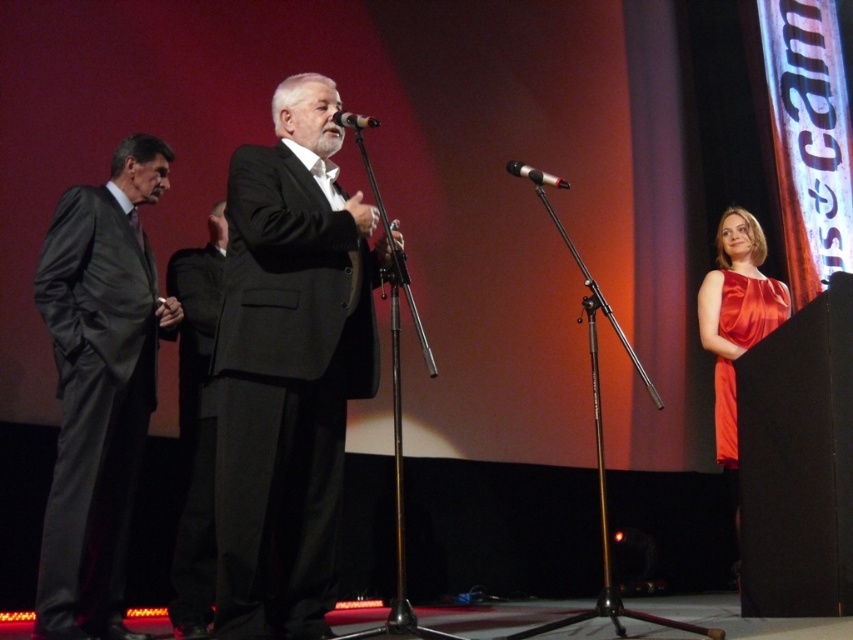
Question: Which object is the farthest from the matte gray suit at left?

Choices:
 (A) metallic silver microphone at center
 (B) satin dress at right
 (C) black metallic microphone at center

Answer: (B)

Question: Does satin dress at right have a larger size compared to metallic silver microphone at center?

Choices:
 (A) yes
 (B) no

Answer: (A)

Question: Among these points, which one is farthest from the camera?

Choices:
 (A) (339, 112)
 (B) (183, 636)

Answer: (B)

Question: Which of the following is the farthest from the observer?

Choices:
 (A) [776, 292]
 (B) [370, 120]
 (C) [120, 515]

Answer: (A)

Question: Is matte black suit at center thinner than matte gray suit at left?

Choices:
 (A) no
 (B) yes

Answer: (A)

Question: Does black matte suit at center have a smaller size compared to metallic silver microphone at center?

Choices:
 (A) no
 (B) yes

Answer: (A)